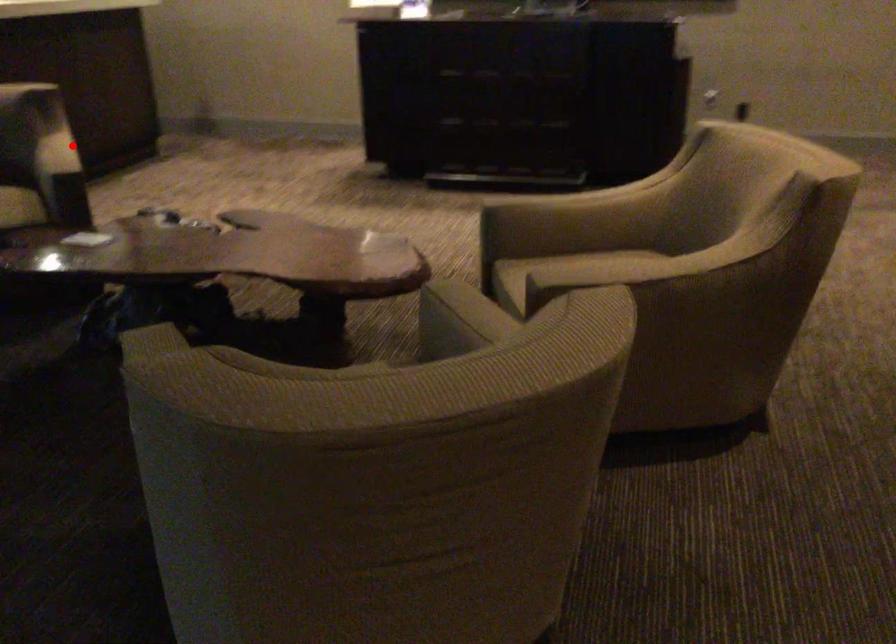
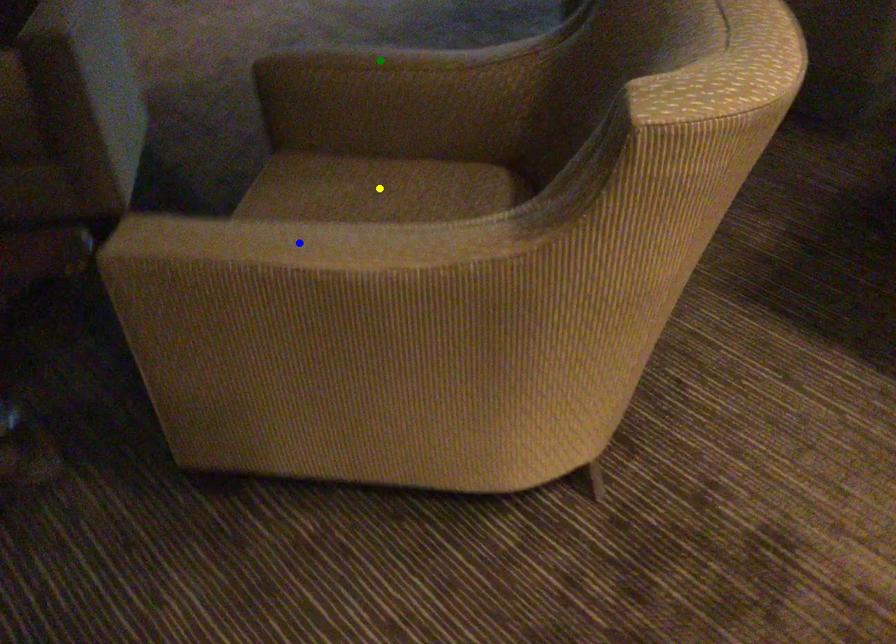
Question: I am providing you with two images of the same scene from different viewpoints. A red point is marked on the first image. You are given multiple points on the second image. In image 2, which mark is for the same physical point as the one in image 1?

Choices:
 (A) green point
 (B) yellow point
 (C) blue point

Answer: (C)